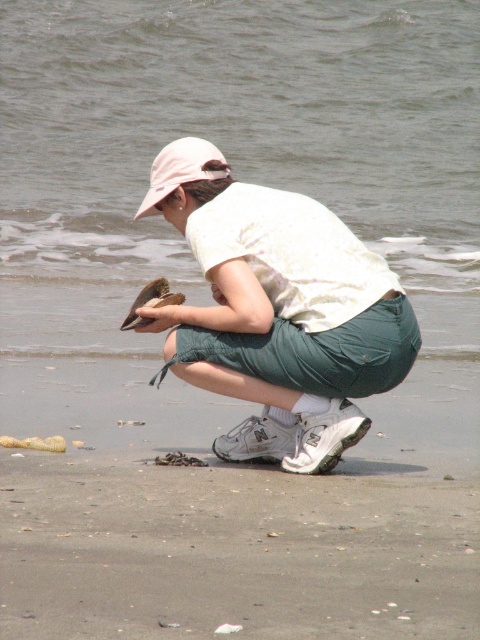
Can you confirm if white cotton shirt at center is positioned to the right of pink fabric baseball cap at upper center?

Yes, white cotton shirt at center is to the right of pink fabric baseball cap at upper center.

This screenshot has width=480, height=640. Find the location of `white cotton shirt at center`. white cotton shirt at center is located at coordinates (277, 310).

You are a GUI agent. You are given a task and a screenshot of the screen. Output one action in this format:
    pyautogui.click(x=<x>, y=<y>)
    Task: Click on the white cotton shirt at center
    The image size is (480, 640).
    Given the screenshot: What is the action you would take?
    pyautogui.click(x=277, y=310)

Can you confirm if pink fabric baseball cap at upper center is thinner than brown feathered bird at center?

→ No.

Is point (208, 172) less distant than point (154, 282)?

Yes, it is.

Find the location of a particular element. This screenshot has width=480, height=640. pink fabric baseball cap at upper center is located at coordinates (179, 170).

Is point (275, 304) behind point (151, 284)?

That is False.

Which is behind, point (249, 376) or point (145, 298)?

The point (145, 298) is behind.

Locate an element on the screen. This screenshot has width=480, height=640. white cotton shirt at center is located at coordinates (277, 310).